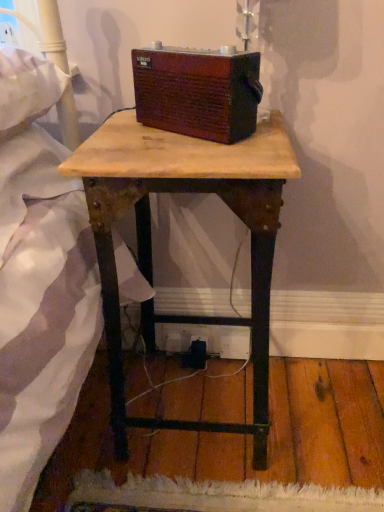
Question: Is wooden table at center a part of brown wood radio at center?

Choices:
 (A) no
 (B) yes

Answer: (A)

Question: From the image's perspective, does brown wood radio at center appear higher than wooden table at center?

Choices:
 (A) no
 (B) yes

Answer: (B)

Question: Is brown wood radio at center to the left of wooden table at center from the viewer's perspective?

Choices:
 (A) yes
 (B) no

Answer: (B)

Question: From the image's perspective, does brown wood radio at center appear lower than wooden table at center?

Choices:
 (A) yes
 (B) no

Answer: (B)

Question: From a real-world perspective, is brown wood radio at center on top of wooden table at center?

Choices:
 (A) yes
 (B) no

Answer: (A)

Question: Considering the relative sizes of brown wood radio at center and wooden table at center in the image provided, is brown wood radio at center wider than wooden table at center?

Choices:
 (A) yes
 (B) no

Answer: (B)

Question: Can you confirm if wooden table at center is taller than brown wood radio at center?

Choices:
 (A) yes
 (B) no

Answer: (A)

Question: Does wooden table at center have a smaller size compared to brown wood radio at center?

Choices:
 (A) yes
 (B) no

Answer: (B)

Question: Can you confirm if wooden table at center is thinner than brown wood radio at center?

Choices:
 (A) no
 (B) yes

Answer: (A)

Question: Is wooden table at center aimed at brown wood radio at center?

Choices:
 (A) no
 (B) yes

Answer: (A)

Question: From the image's perspective, is wooden table at center located above brown wood radio at center?

Choices:
 (A) no
 (B) yes

Answer: (A)

Question: Can you confirm if wooden table at center is positioned to the right of brown wood radio at center?

Choices:
 (A) yes
 (B) no

Answer: (B)

Question: Considering the positions of brown wood radio at center and wooden table at center in the image, is brown wood radio at center taller or shorter than wooden table at center?

Choices:
 (A) tall
 (B) short

Answer: (B)